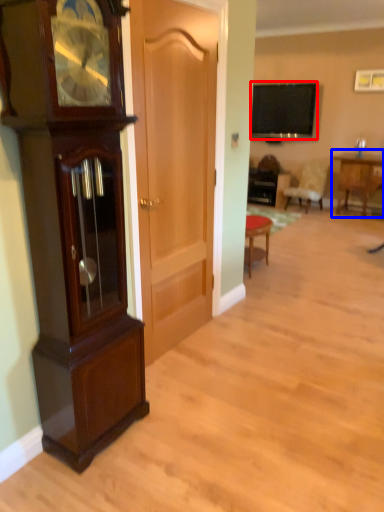
Question: Which object is closer to the camera taking this photo, television (highlighted by a red box) or table (highlighted by a blue box)?

Choices:
 (A) television
 (B) table

Answer: (B)